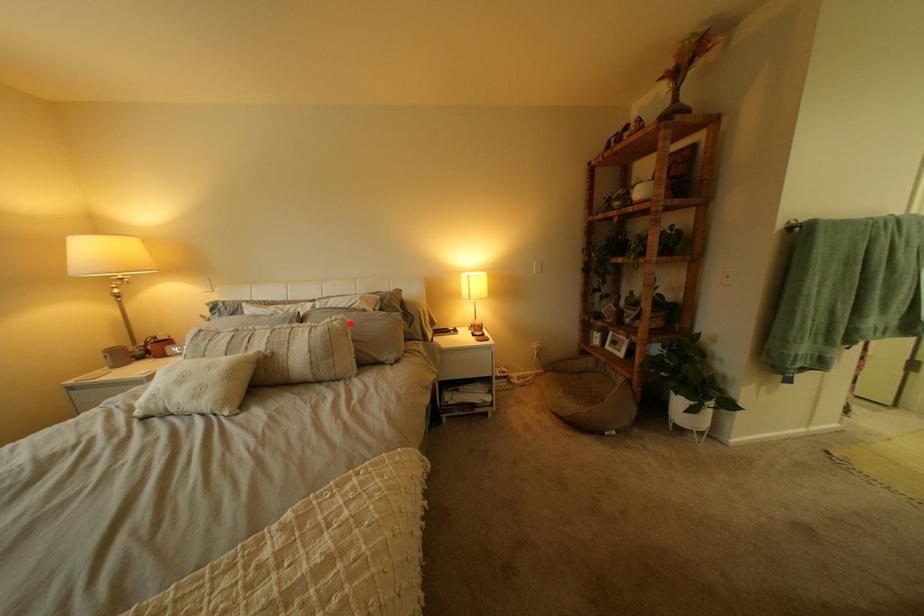
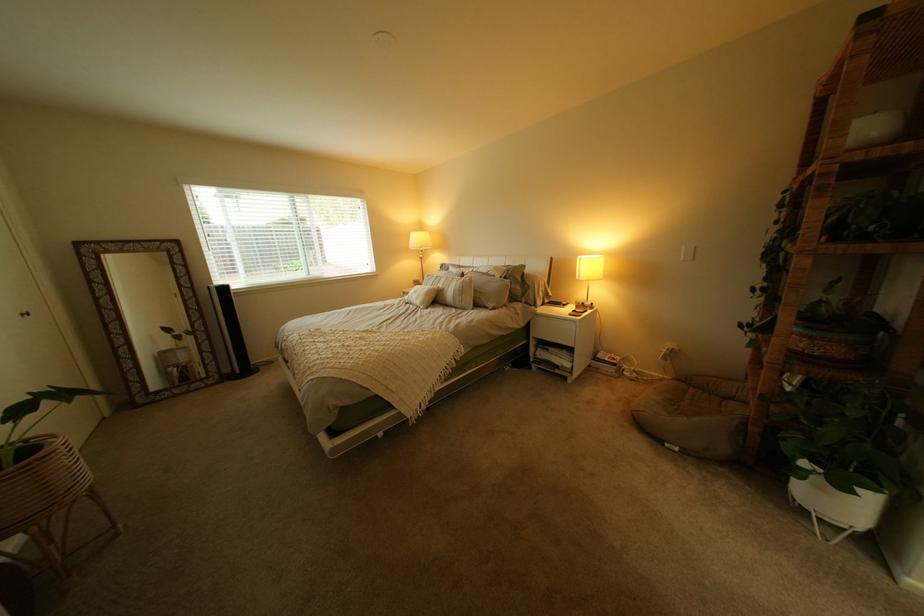
Locate, in the second image, the point that corresponds to the highlighted location in the first image.

(482, 280)